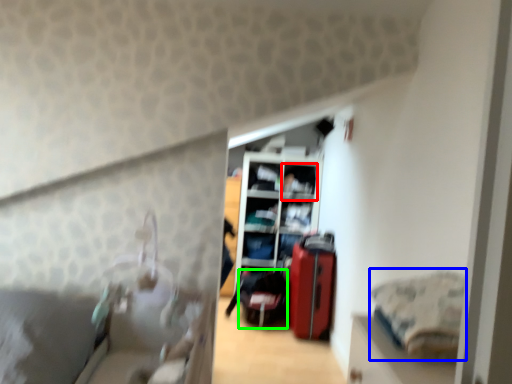
Question: Which object is the farthest from shelf (highlighted by a red box)? Choose among these: bedding (highlighted by a blue box) or luggage (highlighted by a green box).

Choices:
 (A) bedding
 (B) luggage

Answer: (A)